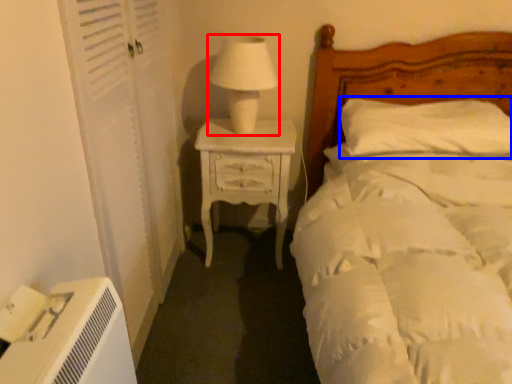
Question: Which object appears farthest to the camera in this image, table lamp (highlighted by a red box) or pillow (highlighted by a blue box)?

Choices:
 (A) table lamp
 (B) pillow

Answer: (B)